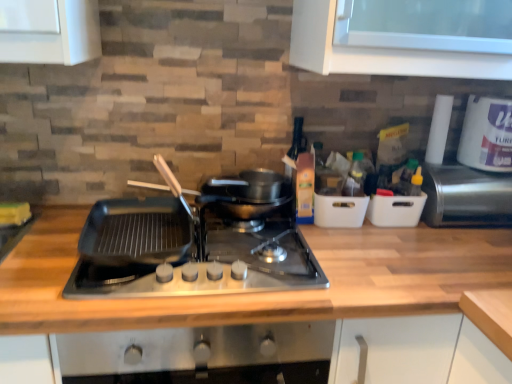
What are the coordinates of `unoccupied area in front of white plastic container at right, the 1th appliance when ordered from left to right` in the screenshot? It's located at (412, 246).